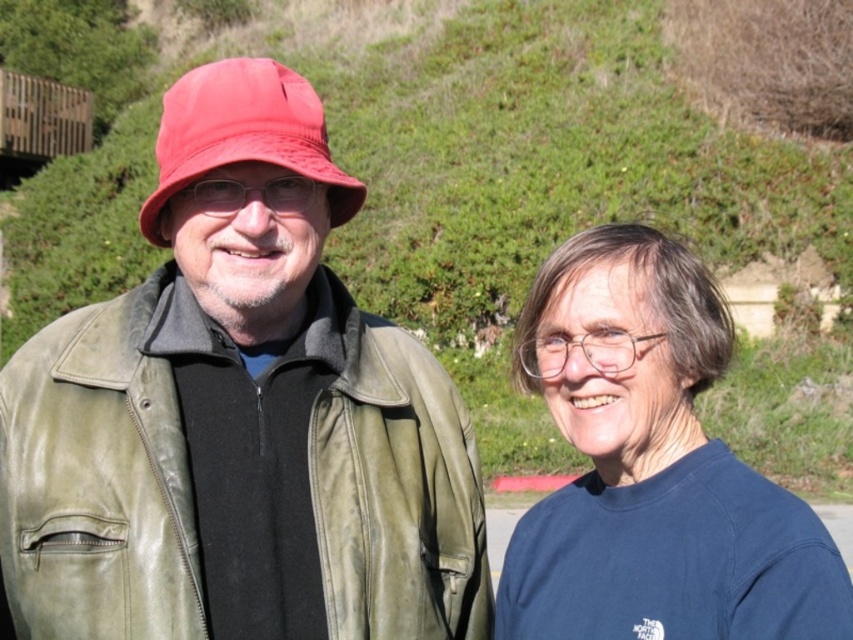
Looking at this image, you are standing at point (248, 179) and want to walk to point (689, 392). Which direction should you move in relation to the two people in the image?

You should move towards the direction of the person on the right since point (248, 179) is in front of point (689, 392), meaning you need to walk backward or away from the people to reach your destination.

You are a photographer trying to frame a shot of the two people in the image. You want to place the matte green leather jacket at left in the center of your viewfinder. What coordinate should you adjust your camera to focus on?

The matte green leather jacket at left is located at coordinate point (238, 417), so you should adjust your camera to focus on that coordinate to center it in your viewfinder.

You are a photographer setting up a shot of the two people in the scene. You want to ensure both the blue cotton shirt at right and the matte red bucket hat at left are clearly visible. Which object should you focus on first to ensure proper exposure, considering their size?

The blue cotton shirt at right is smaller in size than the matte red bucket hat at left. To ensure proper exposure, focus on the larger matte red bucket hat at left first, as it occupies more space and will help balance the lighting for both objects.